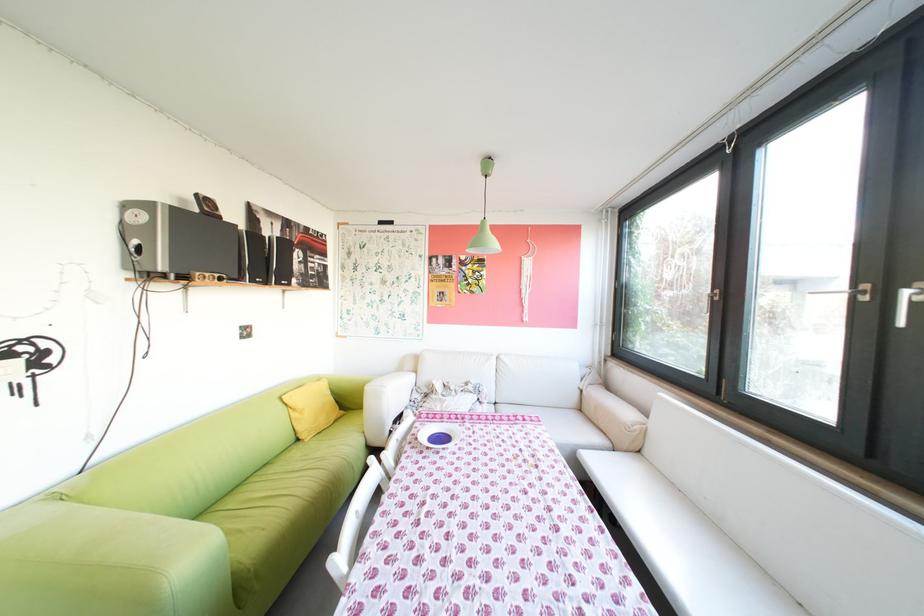
Describe the element at coordinates (107, 562) in the screenshot. I see `the green sofa armrest` at that location.